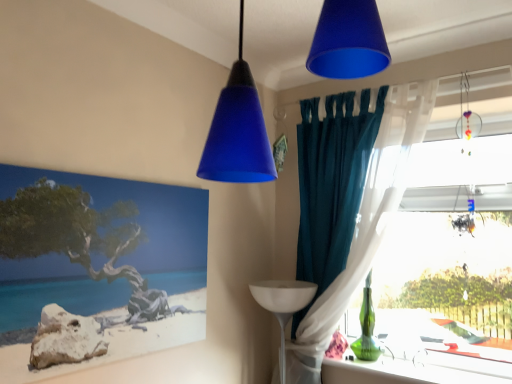
What do you see at coordinates (366, 223) in the screenshot?
I see `teal fabric curtain at right` at bounding box center [366, 223].

Locate an element on the screen. white glossy table lamp at lower right is located at coordinates (283, 305).

Considering the sizes of objects matte canvas painting at left and matte blue cone at upper center, which is the 2th lamp from right to left, in the image provided, who is thinner, matte canvas painting at left or matte blue cone at upper center, which is the 2th lamp from right to left,?

matte canvas painting at left is thinner.

Who is shorter, matte canvas painting at left or matte blue cone at upper center, acting as the 1th lamp starting from the front?

matte blue cone at upper center, acting as the 1th lamp starting from the front, is shorter.

Is matte canvas painting at left bigger than matte blue cone at upper center, acting as the 1th lamp starting from the front?

Incorrect, matte canvas painting at left is not larger than matte blue cone at upper center, acting as the 1th lamp starting from the front.

How different are the orientations of matte canvas painting at left and matte blue cone at upper center, acting as the 1th lamp starting from the front, in degrees?

2.82 degrees.

Measure the distance between teal fabric curtain at right and transparent glass table at right.

teal fabric curtain at right is 15.17 inches from transparent glass table at right.

Which of these two, teal fabric curtain at right or transparent glass table at right, is smaller?

With smaller size is transparent glass table at right.

Can you see teal fabric curtain at right touching transparent glass table at right?

teal fabric curtain at right and transparent glass table at right are clearly separated.

In terms of width, does teal fabric curtain at right look wider or thinner when compared to transparent glass table at right?

teal fabric curtain at right is wider than transparent glass table at right.

Which of these two, green glass bottle at lower right or translucent glass ornament at upper right, the 2th lamp viewed from the front, is bigger?

translucent glass ornament at upper right, the 2th lamp viewed from the front, is bigger.

Looking at this image, from a real-world perspective, is green glass bottle at lower right physically located above or below translucent glass ornament at upper right, the 1th lamp viewed from the right?

Clearly, from a real-world perspective, green glass bottle at lower right is below translucent glass ornament at upper right, the 1th lamp viewed from the right.

Between green glass bottle at lower right and translucent glass ornament at upper right, which appears as the 2th lamp when viewed from the left, which one has more height?

With more height is translucent glass ornament at upper right, which appears as the 2th lamp when viewed from the left.

Between green glass bottle at lower right and translucent glass ornament at upper right, the 1th lamp viewed from the right, which one has larger width?

With larger width is green glass bottle at lower right.

From the image's perspective, is transparent glass table at right located above or below translucent glass ornament at upper right, which ranks as the 1th lamp in back-to-front order?

Based on their image positions, transparent glass table at right is located beneath translucent glass ornament at upper right, which ranks as the 1th lamp in back-to-front order.

Could you tell me if transparent glass table at right is turned towards translucent glass ornament at upper right, the 1th lamp viewed from the right?

Yes, transparent glass table at right is oriented towards translucent glass ornament at upper right, the 1th lamp viewed from the right.

Is translucent glass ornament at upper right, the 1th lamp viewed from the right, inside transparent glass table at right?

No, translucent glass ornament at upper right, the 1th lamp viewed from the right, is not a part of transparent glass table at right.

Is green glass bottle at lower right far from white glossy table lamp at lower right?

green glass bottle at lower right is near white glossy table lamp at lower right, not far away.

Measure the distance between green glass bottle at lower right and white glossy table lamp at lower right.

16.39 inches.

Is green glass bottle at lower right wider or thinner than white glossy table lamp at lower right?

In the image, green glass bottle at lower right appears to be more narrow than white glossy table lamp at lower right.

From a real-world perspective, is green glass bottle at lower right above or below white glossy table lamp at lower right?

green glass bottle at lower right is below white glossy table lamp at lower right.

Is teal fabric curtain at right spatially inside matte canvas painting at left, or outside of it?

The correct answer is: outside.

Which point is more distant from viewer, (x=313, y=351) or (x=42, y=301)?

The point (x=313, y=351) is farther from the camera.

Is teal fabric curtain at right far away from matte canvas painting at left?

No, there isn't a large distance between teal fabric curtain at right and matte canvas painting at left.

From a real-world perspective, is teal fabric curtain at right located higher than matte canvas painting at left?

Yes.

Is transparent glass table at right turned away from white glossy table lamp at lower right?

No, transparent glass table at right's orientation is not away from white glossy table lamp at lower right.

Are transparent glass table at right and white glossy table lamp at lower right far apart?

No, transparent glass table at right is not far away from white glossy table lamp at lower right.

Looking at this image, between transparent glass table at right and white glossy table lamp at lower right, which one is positioned in front?

transparent glass table at right is more forward.

Which of these two, transparent glass table at right or white glossy table lamp at lower right, stands shorter?

white glossy table lamp at lower right is shorter.

Identify the location of lamp that is the 2nd one when counting upward from the matte canvas painting at left (from the image's perspective). This screenshot has height=384, width=512. (238, 131).

The image size is (512, 384). What are the coordinates of `curtain below the transparent glass table at right (from a real-world perspective)` in the screenshot? It's located at (366, 223).

When comparing their distances from teal fabric curtain at right, does green glass bottle at lower right or white glossy table lamp at lower right seem closer?

white glossy table lamp at lower right.

From the image, which object appears to be farther from green glass bottle at lower right, matte canvas painting at left or translucent glass ornament at upper right, which ranks as the 1th lamp in back-to-front order?

The object further to green glass bottle at lower right is matte canvas painting at left.

Considering their positions, is white glossy table lamp at lower right positioned further to matte blue cone at upper center, which is the 2th lamp from right to left, than transparent glass table at right?

Based on the image, transparent glass table at right appears to be further to matte blue cone at upper center, which is the 2th lamp from right to left.

When comparing their distances from white glossy table lamp at lower right, does teal fabric curtain at right or matte blue cone at upper center, acting as the 1th lamp starting from the front, seem further?

matte blue cone at upper center, acting as the 1th lamp starting from the front.

When comparing their distances from white glossy table lamp at lower right, does translucent glass ornament at upper right, which ranks as the 1th lamp in back-to-front order, or matte canvas painting at left seem closer?

matte canvas painting at left.

Based on their spatial positions, is translucent glass ornament at upper right, the 1th lamp viewed from the right, or matte blue cone at upper center, which is the 2th lamp from right to left, closer to teal fabric curtain at right?

The object closer to teal fabric curtain at right is translucent glass ornament at upper right, the 1th lamp viewed from the right.

Looking at the image, which one is located further to teal fabric curtain at right, green glass bottle at lower right or matte canvas painting at left?

matte canvas painting at left lies further to teal fabric curtain at right than the other object.

Estimate the real-world distances between objects in this image. Which object is further from transparent glass table at right, teal fabric curtain at right or translucent glass ornament at upper right, which ranks as the 1th lamp in back-to-front order?

Among the two, teal fabric curtain at right is located further to transparent glass table at right.

Where is `curtain between matte canvas painting at left and translucent glass ornament at upper right, the 2th lamp viewed from the front, from left to right`? curtain between matte canvas painting at left and translucent glass ornament at upper right, the 2th lamp viewed from the front, from left to right is located at coordinates (366, 223).

At what (x,y) coordinates should I click in order to perform the action: click on picture frame located between matte blue cone at upper center, acting as the 1th lamp starting from the front, and teal fabric curtain at right in the depth direction. Please return your answer as a coordinate pair (x, y). Looking at the image, I should click on (99, 263).

Identify the location of table lamp between translucent glass ornament at upper right, the 1th lamp viewed from the right, and green glass bottle at lower right from top to bottom. The image size is (512, 384). (283, 305).

Locate an element on the screen. This screenshot has width=512, height=384. picture frame positioned between matte blue cone at upper center, acting as the 1th lamp starting from the front, and white glossy table lamp at lower right from near to far is located at coordinates (99, 263).